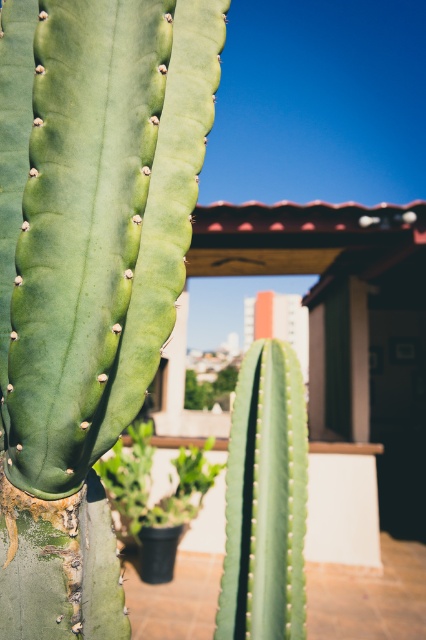
Is green rough cactus at center below green matte cactus at center?

Actually, green rough cactus at center is above green matte cactus at center.

Who is more distant from viewer, (11,244) or (233,528)?

Positioned behind is point (233,528).

The height and width of the screenshot is (640, 426). What are the coordinates of `green rough cactus at center` in the screenshot? It's located at point(88,273).